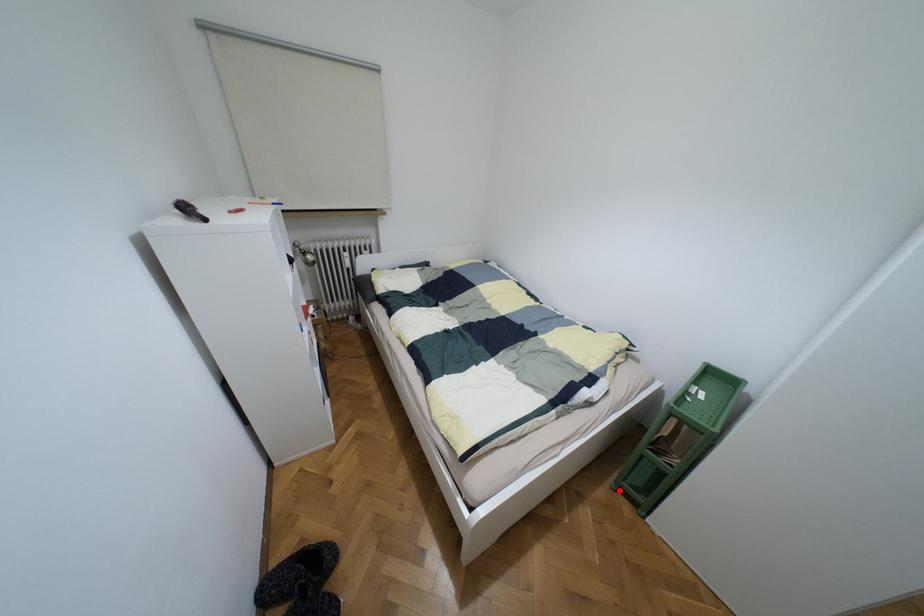
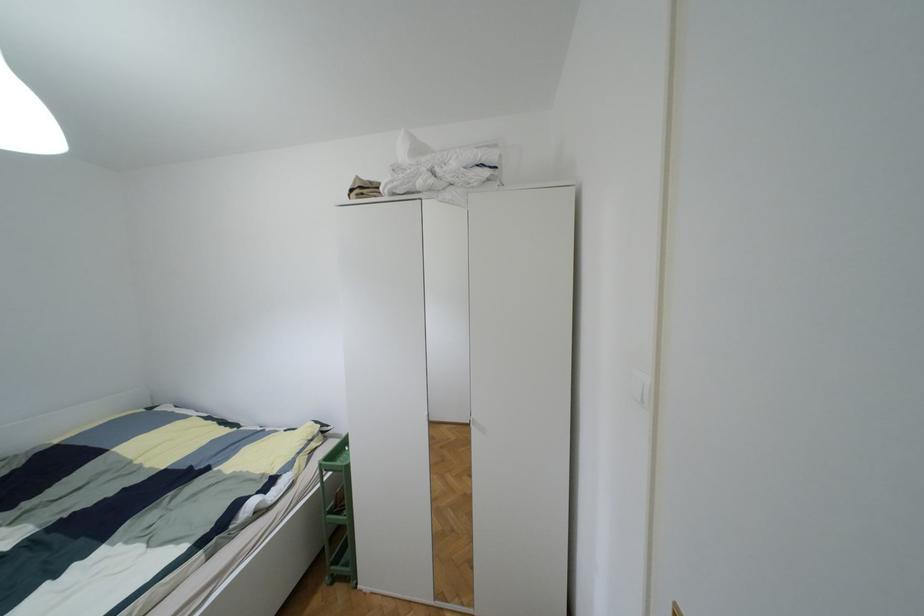
Question: I am providing you with two images of the same scene from different viewpoints. Given a red point in image1, look at the same physical point in image2. Is it:

Choices:
 (A) Closer to the viewpoint
 (B) Farther from the viewpoint

Answer: (B)